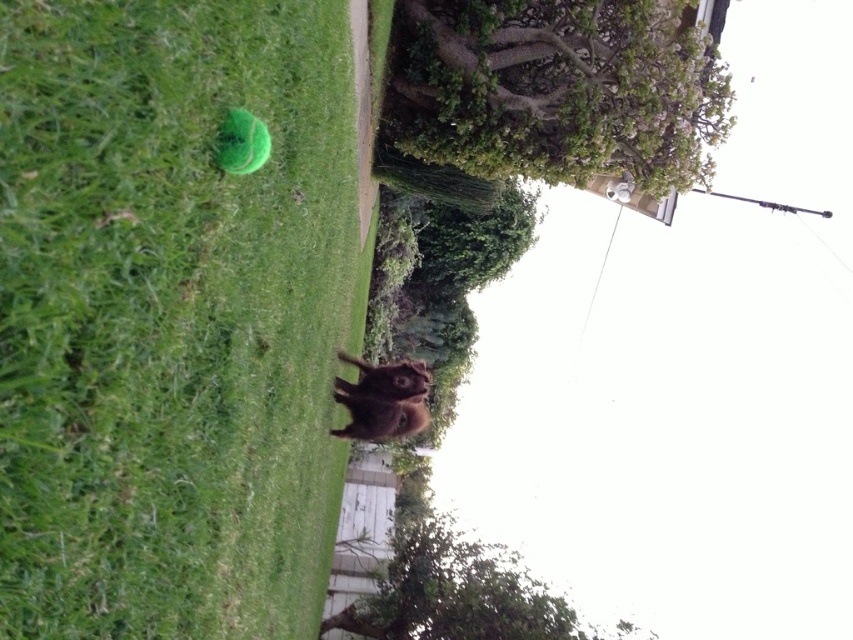
Does green leafy tree at upper center have a greater width compared to green leafy tree at lower center?

Incorrect, green leafy tree at upper center's width does not surpass green leafy tree at lower center's.

Consider the image. Who is more forward, (589, 134) or (451, 616)?

Point (589, 134) is in front.

Is point (489, 12) farther from camera compared to point (488, 627)?

No, (489, 12) is in front of (488, 627).

This screenshot has height=640, width=853. I want to click on green leafy tree at upper center, so click(x=558, y=88).

Who is positioned more to the right, green grass at lower left or brown furry dog at center?

brown furry dog at center

This screenshot has height=640, width=853. Describe the element at coordinates (169, 316) in the screenshot. I see `green grass at lower left` at that location.

Find the location of `green grass at lower left`. green grass at lower left is located at coordinates (169, 316).

Does green grass at lower left have a greater height compared to green leafy tree at upper center?

Indeed, green grass at lower left has a greater height compared to green leafy tree at upper center.

Who is positioned more to the left, green grass at lower left or green leafy tree at upper center?

Positioned to the left is green grass at lower left.

Where is `green grass at lower left`? The image size is (853, 640). green grass at lower left is located at coordinates (169, 316).